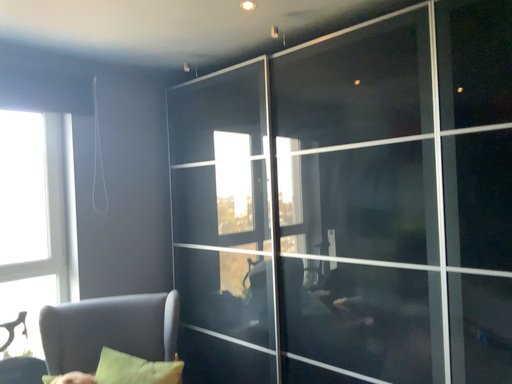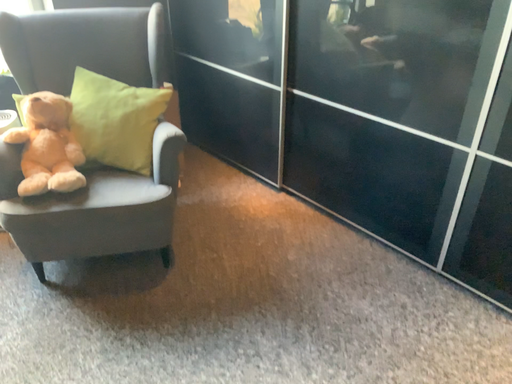
Question: How did the camera likely rotate when shooting the video?

Choices:
 (A) rotated upward
 (B) rotated downward

Answer: (B)